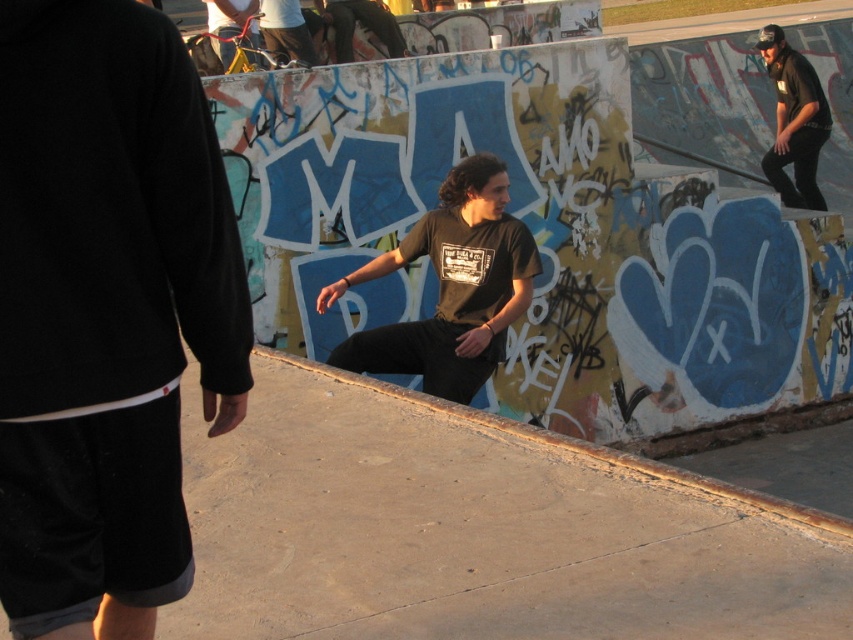
From the picture: You are a photographer positioned at the camera. You want to capture a closeup shot of the black matte shorts at lower left. Can you get within 8 feet of the subject without moving the camera position?

The distance between the black matte shorts at lower left and the camera is 7.87 feet, so yes, you can get within 8 feet without moving the camera position.

You are a photographer trying to capture the black matte shorts at lower left in the image. What are the exact coordinates where you should focus your camera to ensure the shorts are centered in the frame?

The exact coordinates to focus on are point [106,312] to center the black matte shorts at lower left in the frame.

You are at a skatepark and see a curved ramp in the foreground. There is a point marked at coordinates (106, 312). What object is located at this point?

The point at coordinates (106, 312) corresponds to the black matte shorts at lower left.